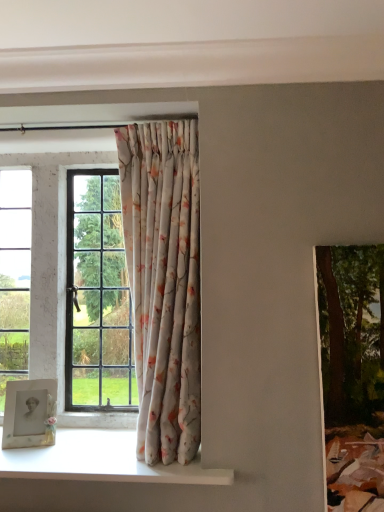
Describe the element at coordinates (101, 461) in the screenshot. This screenshot has height=512, width=384. I see `white glossy window sill at lower left` at that location.

Locate an element on the screen. white glossy window sill at lower left is located at coordinates (101, 461).

The width and height of the screenshot is (384, 512). What do you see at coordinates (164, 282) in the screenshot?
I see `floral fabric curtain at center` at bounding box center [164, 282].

This screenshot has width=384, height=512. What are the coordinates of `white glossy window sill at lower left` in the screenshot? It's located at (101, 461).

From the image's perspective, is white glossy window sill at lower left below floral fabric curtain at center?

Yes, from the image's perspective, white glossy window sill at lower left is below floral fabric curtain at center.

In terms of size, does white glossy window sill at lower left appear bigger or smaller than floral fabric curtain at center?

white glossy window sill at lower left is smaller than floral fabric curtain at center.

In the image, is white glossy window sill at lower left positioned in front of or behind floral fabric curtain at center?

Clearly, white glossy window sill at lower left is in front of floral fabric curtain at center.

Does point (33, 456) come in front of point (183, 134)?

Yes, it is.

From the picture: Is matte white picture frame at lower left not close to green textured painting at right?

matte white picture frame at lower left is positioned a significant distance from green textured painting at right.

What's the angular difference between matte white picture frame at lower left and green textured painting at right's facing directions?

There is a 14.9-degree angle between the facing directions of matte white picture frame at lower left and green textured painting at right.

Which object is positioned more to the right, matte white picture frame at lower left or green textured painting at right?

From the viewer's perspective, green textured painting at right appears more on the right side.

Does green textured painting at right have a smaller size compared to matte white picture frame at lower left?

No, green textured painting at right is not smaller than matte white picture frame at lower left.

In the scene shown: Is green textured painting at right thinner than matte white picture frame at lower left?

Incorrect, the width of green textured painting at right is not less than that of matte white picture frame at lower left.

Where is `tree located above the matte white picture frame at lower left (from the image's perspective)`? This screenshot has height=512, width=384. tree located above the matte white picture frame at lower left (from the image's perspective) is located at coordinates (351, 332).

Does green textured painting at right appear on the right side of white glossy window sill at lower left?

Correct, you'll find green textured painting at right to the right of white glossy window sill at lower left.

Is point (369, 419) closer to camera compared to point (111, 456)?

Yes, point (369, 419) is in front of point (111, 456).

Can you tell me how much green textured painting at right and white glossy window sill at lower left differ in facing direction?

The angle between the facing direction of green textured painting at right and the facing direction of white glossy window sill at lower left is 0.00576 degrees.

You are a GUI agent. You are given a task and a screenshot of the screen. Output one action in this format:
    pyautogui.click(x=<x>, y=<y>)
    Task: Click on the window sill below the green textured painting at right (from the image's perspective)
    Image resolution: width=384 pixels, height=512 pixels.
    Given the screenshot: What is the action you would take?
    click(x=101, y=461)

Can you confirm if green textured painting at right is positioned to the left of floral fabric curtain at center?

No.

Would you say green textured painting at right is a long distance from floral fabric curtain at center?

No.

Which of these two, green textured painting at right or floral fabric curtain at center, is thinner?

green textured painting at right is thinner.

How different are the orientations of green textured painting at right and floral fabric curtain at center in degrees?

The angular difference between green textured painting at right and floral fabric curtain at center is 0.00435 degrees.

I want to click on picture frame on the left of white glossy window sill at lower left, so click(29, 413).

Which of these two, white glossy window sill at lower left or matte white picture frame at lower left, is wider?

white glossy window sill at lower left is wider.

Considering the sizes of objects white glossy window sill at lower left and matte white picture frame at lower left in the image provided, who is taller, white glossy window sill at lower left or matte white picture frame at lower left?

With more height is matte white picture frame at lower left.

Does point (44, 457) come farther from viewer compared to point (46, 388)?

No.

From the image's perspective, which one is positioned higher, floral fabric curtain at center or white glossy window sill at lower left?

floral fabric curtain at center, from the image's perspective.

In the scene shown: How many degrees apart are the facing directions of floral fabric curtain at center and white glossy window sill at lower left?

The facing directions of floral fabric curtain at center and white glossy window sill at lower left are 0.00141 degrees apart.

Does floral fabric curtain at center have a smaller size compared to white glossy window sill at lower left?

Actually, floral fabric curtain at center might be larger than white glossy window sill at lower left.

Where is `curtain behind the white glossy window sill at lower left`? curtain behind the white glossy window sill at lower left is located at coordinates (164, 282).

Where is `picture frame that is below the green textured painting at right (from the image's perspective)`? The width and height of the screenshot is (384, 512). picture frame that is below the green textured painting at right (from the image's perspective) is located at coordinates (29, 413).

Which object lies nearer to the anchor point matte white picture frame at lower left, green textured painting at right or white glossy window sill at lower left?

white glossy window sill at lower left.

Estimate the real-world distances between objects in this image. Which object is closer to matte white picture frame at lower left, green textured painting at right or floral fabric curtain at center?

Among the two, floral fabric curtain at center is located nearer to matte white picture frame at lower left.

Considering their positions, is matte white picture frame at lower left positioned further to white glossy window sill at lower left than green textured painting at right?

Based on the image, green textured painting at right appears to be further to white glossy window sill at lower left.

Looking at this image, based on their spatial positions, is floral fabric curtain at center or matte white picture frame at lower left closer to white glossy window sill at lower left?

Among the two, matte white picture frame at lower left is located nearer to white glossy window sill at lower left.

From the image, which object appears to be farther from floral fabric curtain at center, green textured painting at right or white glossy window sill at lower left?

Among the two, green textured painting at right is located further to floral fabric curtain at center.

Looking at the image, which one is located further to white glossy window sill at lower left, floral fabric curtain at center or green textured painting at right?

green textured painting at right is positioned further to the anchor white glossy window sill at lower left.

Estimate the real-world distances between objects in this image. Which object is further from matte white picture frame at lower left, white glossy window sill at lower left or floral fabric curtain at center?

floral fabric curtain at center lies further to matte white picture frame at lower left than the other object.

When comparing their distances from floral fabric curtain at center, does white glossy window sill at lower left or green textured painting at right seem further?

green textured painting at right.

Identify the location of window sill situated between matte white picture frame at lower left and green textured painting at right from left to right. The image size is (384, 512). (101, 461).

Locate an element on the screen. The height and width of the screenshot is (512, 384). curtain between matte white picture frame at lower left and green textured painting at right in the horizontal direction is located at coordinates (164, 282).

This screenshot has width=384, height=512. I want to click on curtain between white glossy window sill at lower left and green textured painting at right, so click(164, 282).

Where is `picture frame between floral fabric curtain at center and white glossy window sill at lower left in the vertical direction`? picture frame between floral fabric curtain at center and white glossy window sill at lower left in the vertical direction is located at coordinates (29, 413).